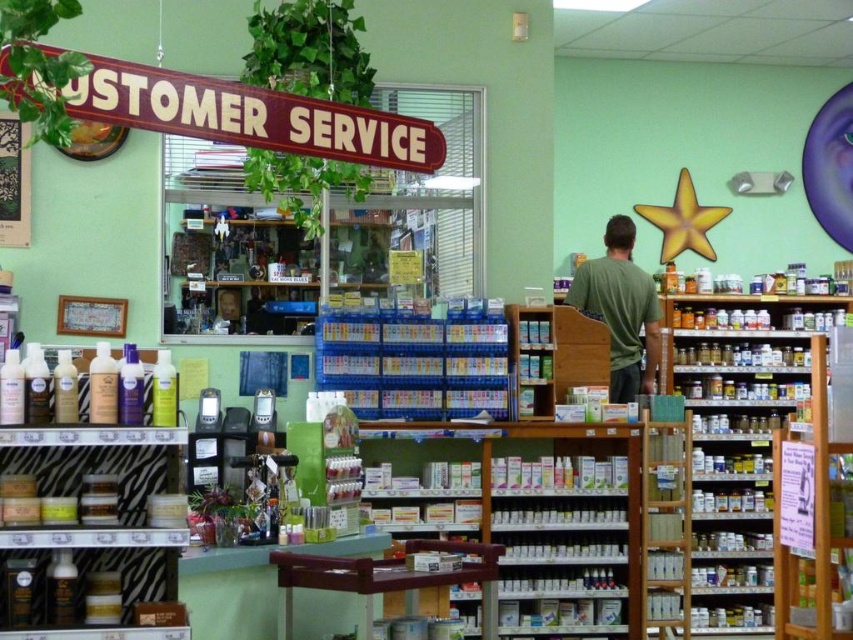
You are a customer in the store and want to know which item is larger between the white plastic bottles at center and the wooden sign at upper left. Can you tell me?

The white plastic bottles at center is bigger than wooden sign at upper left, so the white plastic bottles at center is larger.

You are a store employee who needs to place a 3.0 meter long banner between the wooden shelf at center and the wooden sign at upper left. Can you fit the banner between them without bending it?

The distance between the wooden shelf at center and the wooden sign at upper left is 2.70 meters. Since the banner is 3.0 meters long, it is longer than the space available. Therefore, the banner cannot be placed straight between them without bending it.